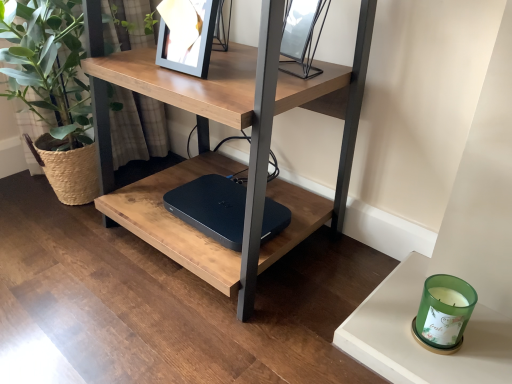
I want to click on vacant space in front of green woven basket at left, so click(65, 270).